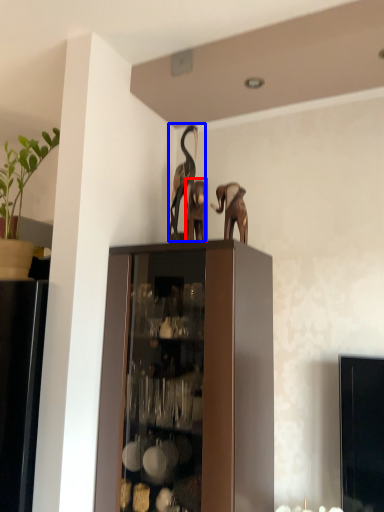
Question: Which object appears farthest to the camera in this image, animal (highlighted by a red box) or animal (highlighted by a blue box)?

Choices:
 (A) animal
 (B) animal

Answer: (B)